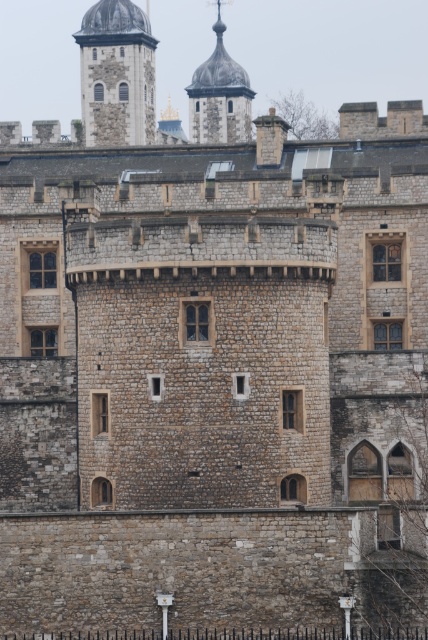
You are an architect examining the historic stone building. You notice two stone domes in the image. Which one is positioned closer to you, the stone dome at upper left or the smooth stone dome at upper center?

The stone dome at upper left is closer to the viewer than the smooth stone dome at upper center.

You are an architect examining the historic stone building. You notice two stone domes, the stone dome at upper left and the smooth stone dome at upper center. Which dome has a larger size?

The smooth stone dome at upper center is larger than the stone dome at upper left.